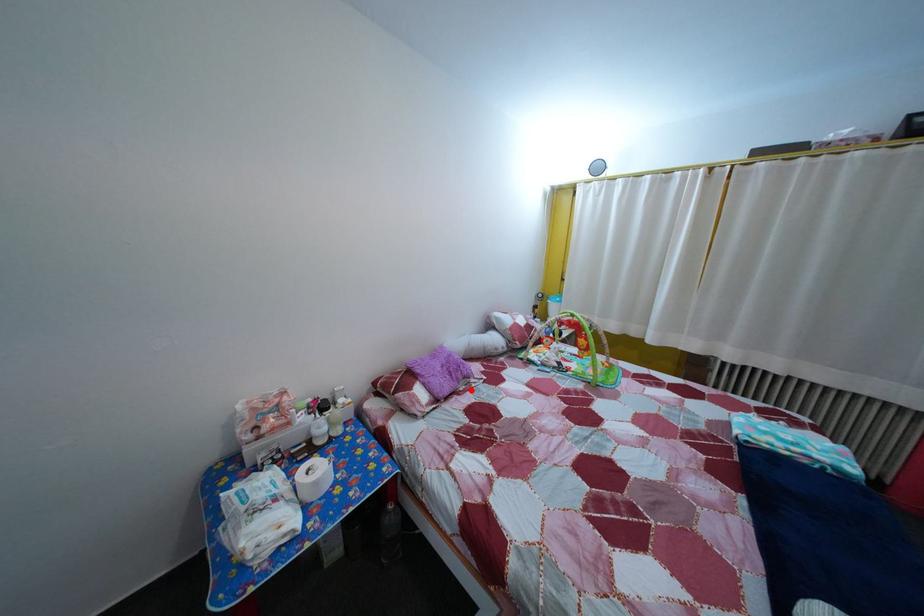
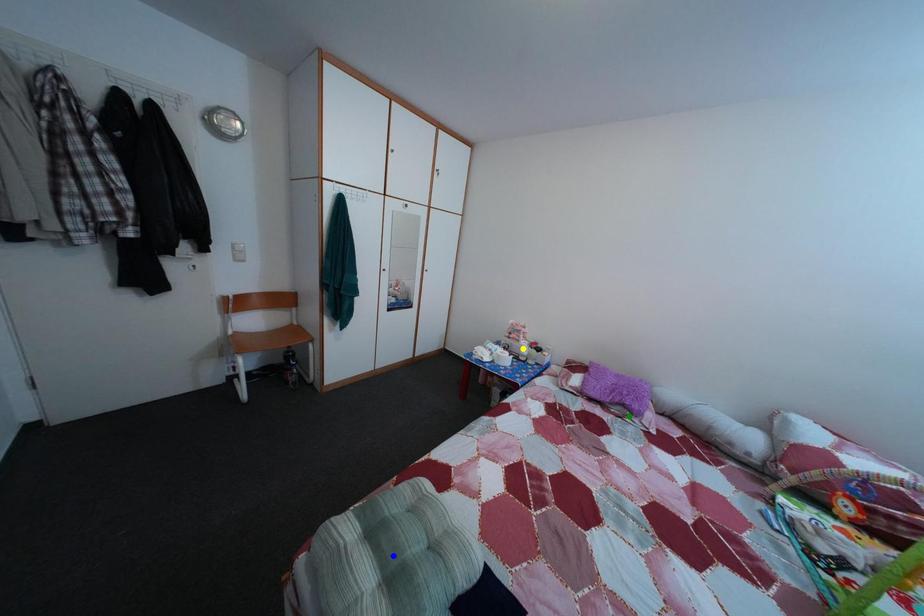
Question: I am providing you with two images of the same scene from different viewpoints. A red point is marked on the first image. You are given multiple points on the second image. Which spot in image 2 lines up with the point in image 1?

Choices:
 (A) yellow point
 (B) blue point
 (C) green point

Answer: (C)